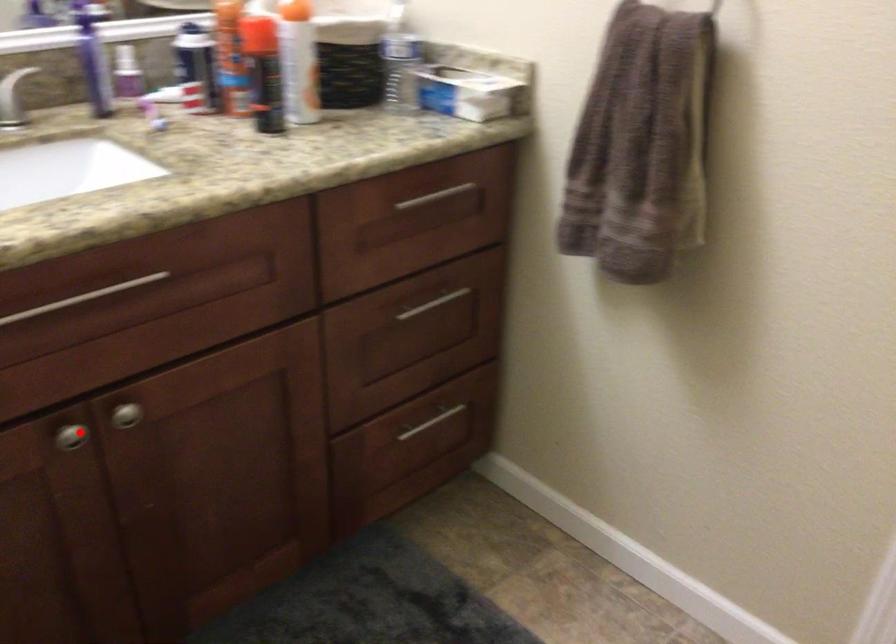
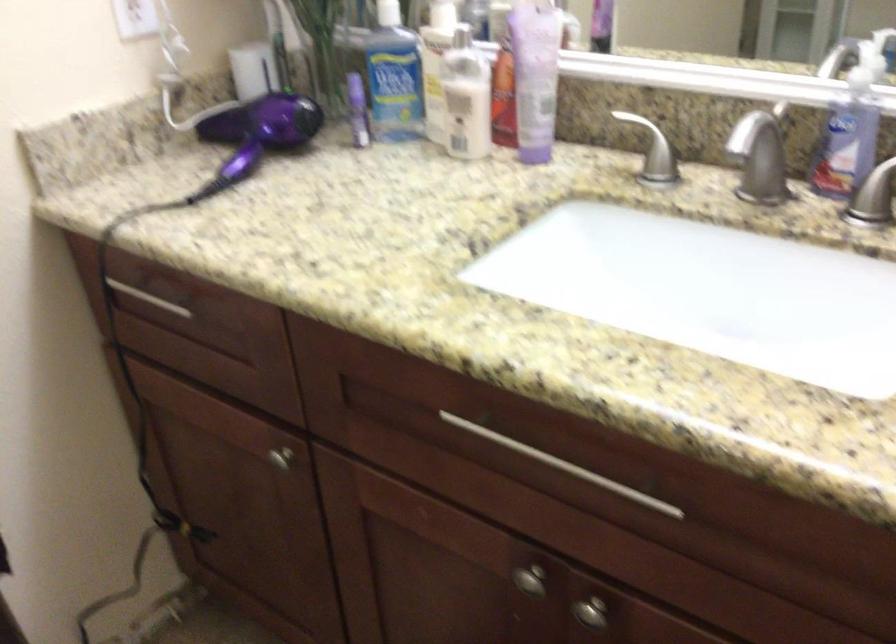
Question: I am providing you with two images of the same scene from different viewpoints. In image1, a red point is highlighted. Considering the same 3D point in image2, which of the following is correct?

Choices:
 (A) It is closer
 (B) It is farther

Answer: (A)